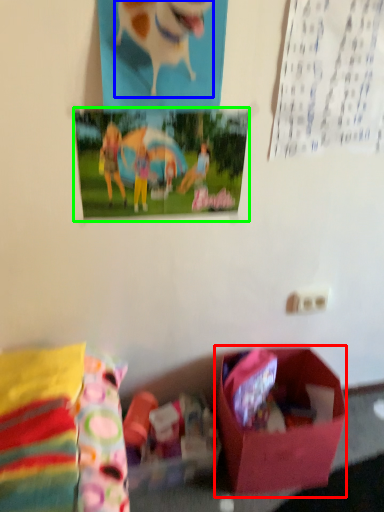
Question: Which object is the closest to the box (highlighted by a red box)? Choose among these: animal (highlighted by a blue box) or postcard (highlighted by a green box).

Choices:
 (A) animal
 (B) postcard

Answer: (B)